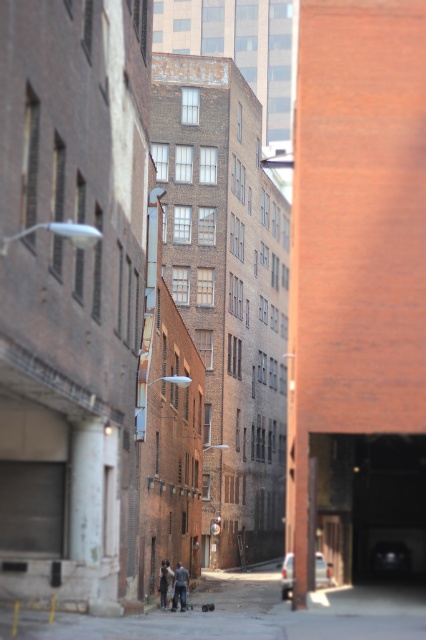
Question: Does concrete sidewalk at center have a lesser width compared to dark gray jeans at center?

Choices:
 (A) yes
 (B) no

Answer: (B)

Question: Estimate the real-world distances between objects in this image. Which object is farther from the dark gray jeans at center?

Choices:
 (A) dark gray jacket at lower center
 (B) concrete sidewalk at center

Answer: (B)

Question: Which object is the farthest from the dark gray jacket at lower center?

Choices:
 (A) concrete sidewalk at center
 (B) dark gray jeans at center

Answer: (A)

Question: Is concrete sidewalk at center to the right of dark gray jeans at center from the viewer's perspective?

Choices:
 (A) no
 (B) yes

Answer: (B)

Question: Does concrete sidewalk at center have a greater width compared to dark gray jeans at center?

Choices:
 (A) yes
 (B) no

Answer: (A)

Question: Which point is closer to the camera taking this photo?

Choices:
 (A) (186, 573)
 (B) (170, 579)

Answer: (A)